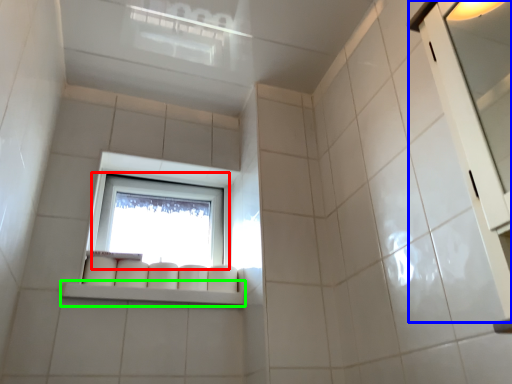
Question: Which is farther away from window (highlighted by a red box)? screen door (highlighted by a blue box) or window sill (highlighted by a green box)?

Choices:
 (A) screen door
 (B) window sill

Answer: (A)